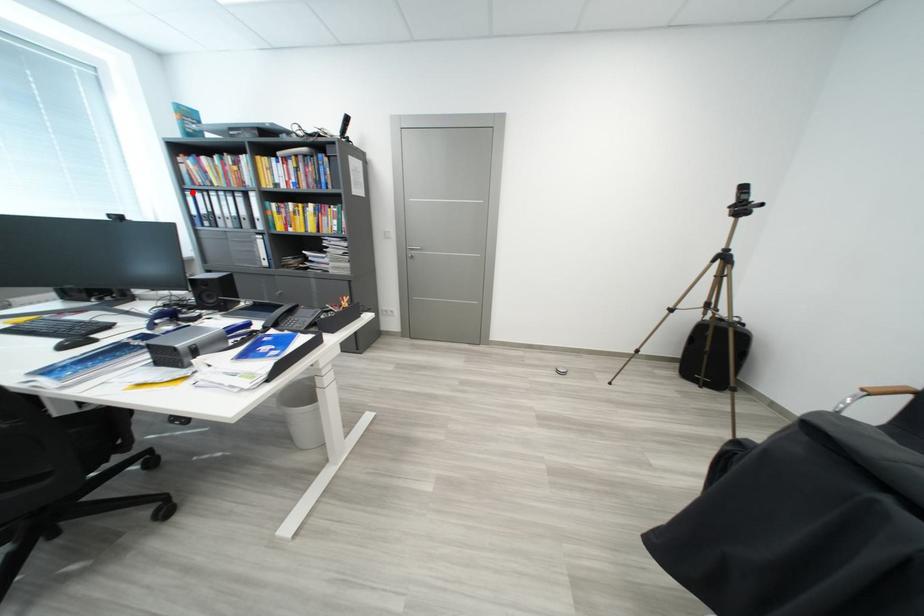
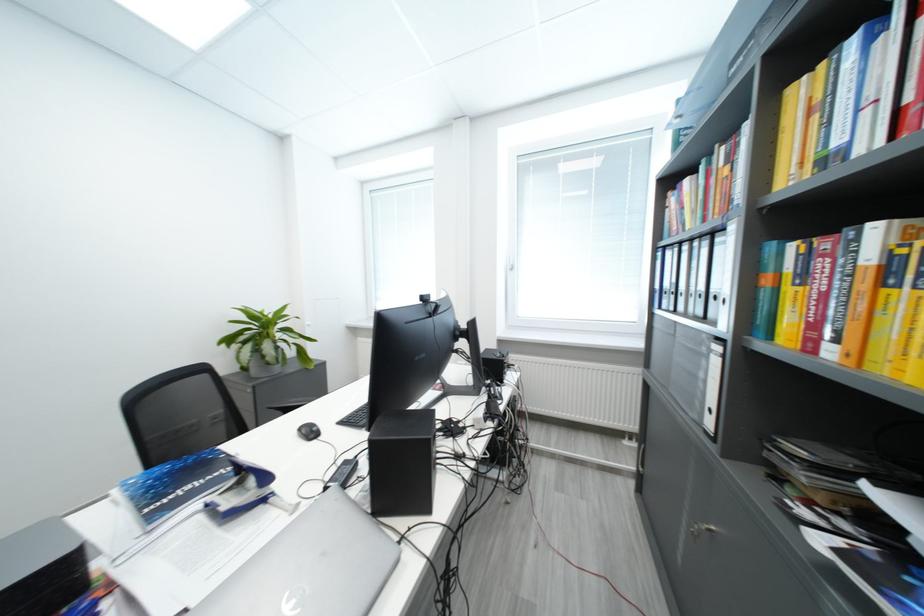
Where in the second image is the point corresponding to the highlighted location from the first image?

(664, 253)